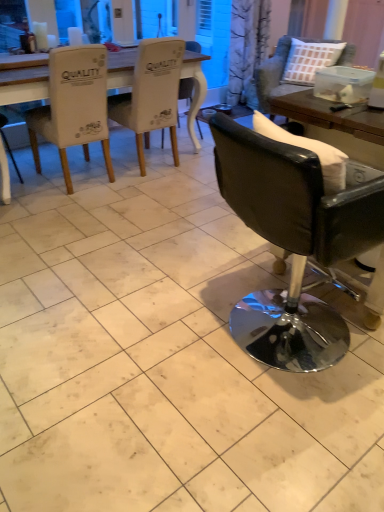
Question: Is black leather chair at right, which ranks as the 1th chair in right-to-left order, smaller than white fabric table at upper left?

Choices:
 (A) yes
 (B) no

Answer: (B)

Question: Is black leather chair at right, which ranks as the 1th chair in right-to-left order, positioned with its back to white fabric table at upper left?

Choices:
 (A) yes
 (B) no

Answer: (B)

Question: Is black leather chair at right, which ranks as the 1th chair in right-to-left order, shorter than white fabric table at upper left?

Choices:
 (A) no
 (B) yes

Answer: (B)

Question: Is black leather chair at right, which ranks as the 1th chair in right-to-left order, outside of white fabric table at upper left?

Choices:
 (A) no
 (B) yes

Answer: (B)

Question: Would you say black leather chair at right, which ranks as the 1th chair in right-to-left order, contains white fabric table at upper left?

Choices:
 (A) no
 (B) yes

Answer: (A)

Question: Can you confirm if black leather chair at right, which ranks as the 1th chair in right-to-left order, is bigger than white fabric table at upper left?

Choices:
 (A) no
 (B) yes

Answer: (B)

Question: Considering the relative sizes of black leather chair at right, the 5th chair from the left, and white fabric chair at center, the third chair when ordered from left to right, in the image provided, is black leather chair at right, the 5th chair from the left, taller than white fabric chair at center, the third chair when ordered from left to right,?

Choices:
 (A) no
 (B) yes

Answer: (B)

Question: Can you confirm if black leather chair at right, which ranks as the 1th chair in right-to-left order, is shorter than white fabric chair at center, which ranks as the 3th chair in right-to-left order?

Choices:
 (A) no
 (B) yes

Answer: (A)

Question: Is black leather chair at right, which ranks as the 1th chair in right-to-left order, facing away from white fabric chair at center, which ranks as the 3th chair in right-to-left order?

Choices:
 (A) no
 (B) yes

Answer: (A)

Question: From the image's perspective, is black leather chair at right, which ranks as the 1th chair in right-to-left order, below white fabric chair at center, the third chair when ordered from left to right?

Choices:
 (A) yes
 (B) no

Answer: (B)

Question: Considering the relative sizes of black leather chair at right, which ranks as the 1th chair in right-to-left order, and white fabric chair at center, which ranks as the 3th chair in right-to-left order, in the image provided, is black leather chair at right, which ranks as the 1th chair in right-to-left order, thinner than white fabric chair at center, which ranks as the 3th chair in right-to-left order,?

Choices:
 (A) yes
 (B) no

Answer: (B)

Question: Can you confirm if black leather chair at right, which ranks as the 1th chair in right-to-left order, is bigger than white fabric chair at center, the third chair when ordered from left to right?

Choices:
 (A) no
 (B) yes

Answer: (B)

Question: Is white fabric chair at upper left, arranged as the 4th chair when viewed from the right, shorter than black leather chair at right, the 5th chair from the left?

Choices:
 (A) yes
 (B) no

Answer: (B)